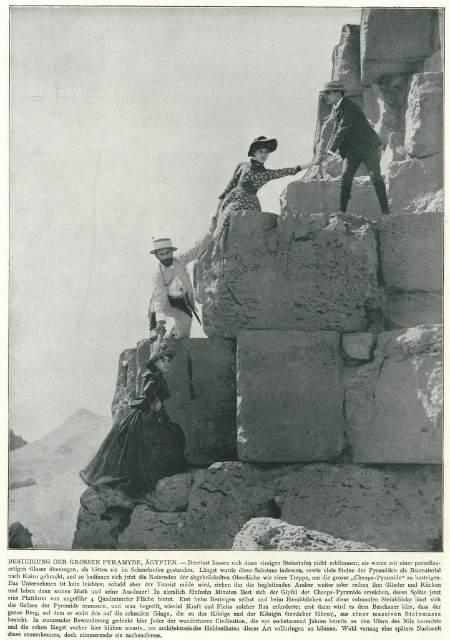
Consider the image. Does matte black dress at lower left have a lesser height compared to white matte hat at center?

In fact, matte black dress at lower left may be taller than white matte hat at center.

Does matte black dress at lower left have a greater height compared to white matte hat at center?

Correct, matte black dress at lower left is much taller as white matte hat at center.

Is point (143, 388) positioned after point (149, 326)?

No, (143, 388) is in front of (149, 326).

Locate an element on the screen. matte black dress at lower left is located at coordinates (140, 436).

Is white matte hat at center to the right of dotted fabric dress at center from the viewer's perspective?

In fact, white matte hat at center is to the left of dotted fabric dress at center.

Is white matte hat at center bigger than dotted fabric dress at center?

No.

Between point (172, 289) and point (224, 227), which one is positioned in front?

Point (224, 227) is more forward.

Identify the location of white matte hat at center. (174, 288).

Who is positioned more to the left, light brown leather hat at upper center or white matte hat at center?

From the viewer's perspective, white matte hat at center appears more on the left side.

Does light brown leather hat at upper center appear on the left side of white matte hat at center?

In fact, light brown leather hat at upper center is to the right of white matte hat at center.

You are a GUI agent. You are given a task and a screenshot of the screen. Output one action in this format:
    pyautogui.click(x=<x>, y=<y>)
    Task: Click on the light brown leather hat at upper center
    
    Given the screenshot: What is the action you would take?
    pyautogui.click(x=351, y=145)